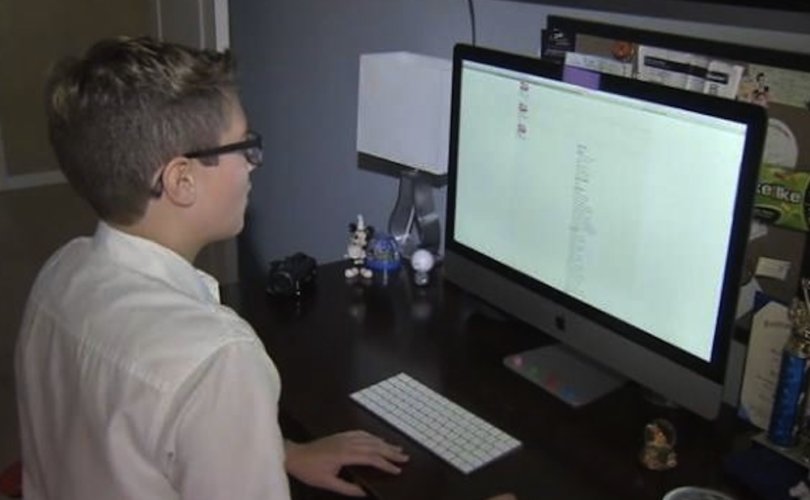
This screenshot has height=500, width=810. In order to click on lamp in this screenshot , I will do `click(384, 146)`.